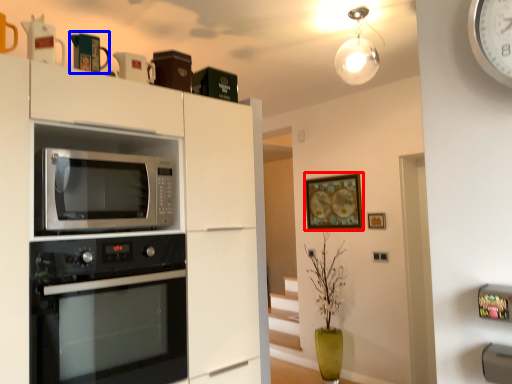
Question: Which of the following is the farthest to the observer, picture frame (highlighted by a red box) or appliance (highlighted by a blue box)?

Choices:
 (A) picture frame
 (B) appliance

Answer: (A)